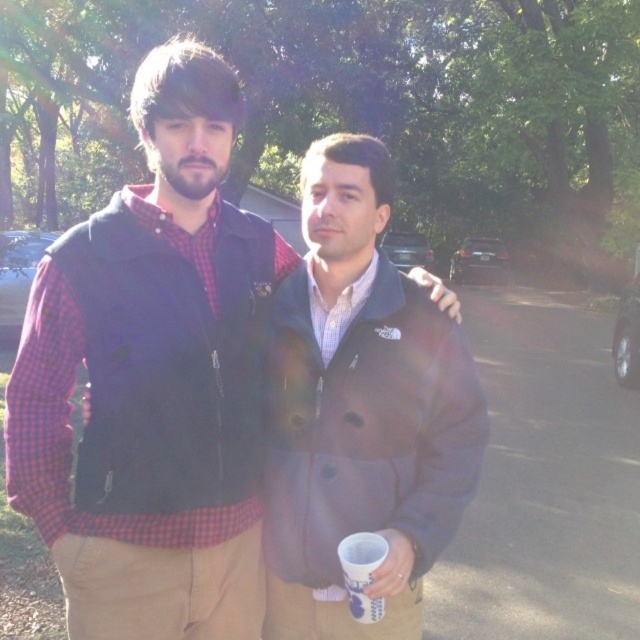
Who is taller, brown woolen jacket at center or white paper cup at lower center?

Standing taller between the two is brown woolen jacket at center.

Identify the location of brown woolen jacket at center. (360, 410).

Which is below, brushed metal vest at upper left or white paper cup at lower center?

white paper cup at lower center

Which of these two, brushed metal vest at upper left or white paper cup at lower center, stands taller?

brushed metal vest at upper left

Based on the photo, who is more distant from viewer, [93,634] or [381,544]?

The point [93,634] is more distant.

Image resolution: width=640 pixels, height=640 pixels. I want to click on brushed metal vest at upper left, so click(154, 380).

Between brushed metal vest at upper left and brown woolen jacket at center, which one appears on the right side from the viewer's perspective?

From the viewer's perspective, brown woolen jacket at center appears more on the right side.

Between point (61, 410) and point (435, 390), which one is positioned in front?

Point (61, 410)

This screenshot has height=640, width=640. Find the location of `brushed metal vest at upper left`. brushed metal vest at upper left is located at coordinates (154, 380).